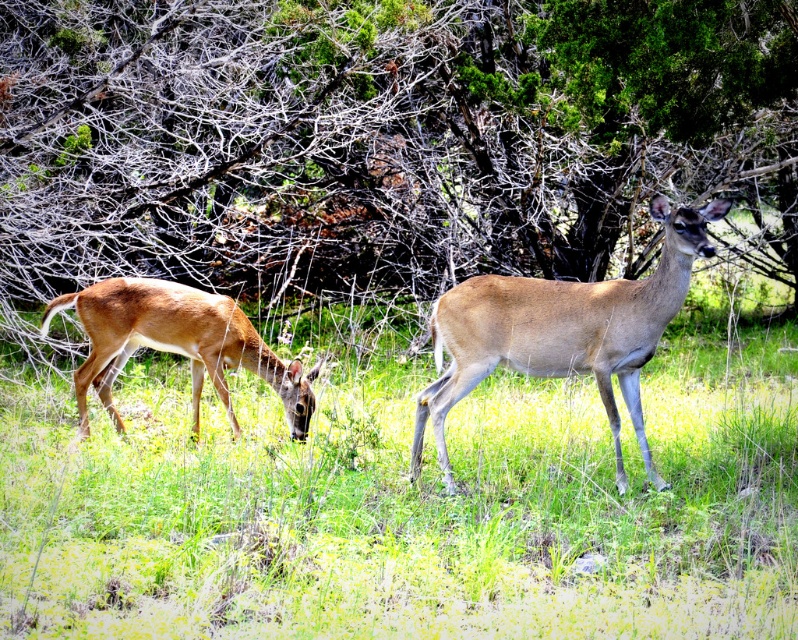
You are standing in the grassy area and want to take a photo of the two deer. To avoid blocking the deer in the foreground, should you position yourself to the left or right of the green leafy tree at center?

You should position yourself to the right of the green leafy tree at center because the tree is located at point [358,138], which is to the left side of the scene. This way, you can avoid blocking the deer in the foreground.